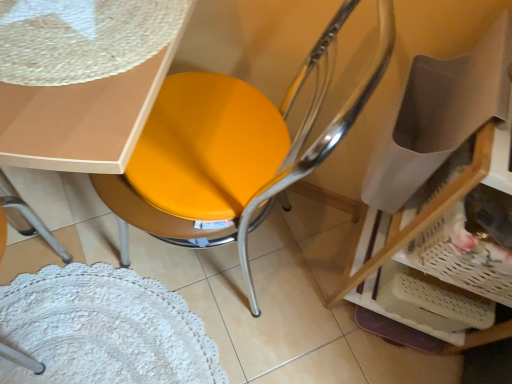
Where is `vacant area on top of matte white table at upper left (from a real-world perspective)`? vacant area on top of matte white table at upper left (from a real-world perspective) is located at coordinates (75, 32).